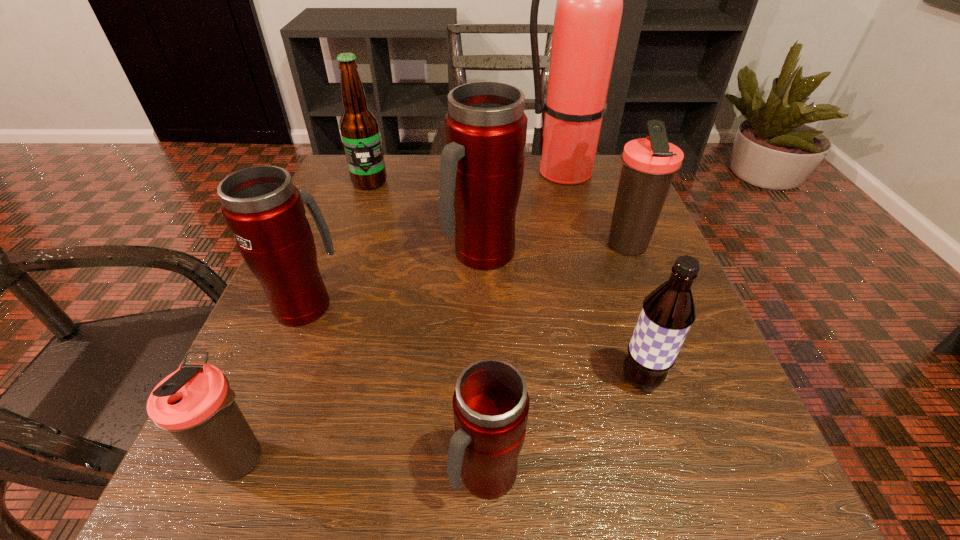
Where is `vacant space located on the side with the handle of the fifth farthest object`? This screenshot has width=960, height=540. vacant space located on the side with the handle of the fifth farthest object is located at coordinates (355, 179).

You are a GUI agent. You are given a task and a screenshot of the screen. Output one action in this format:
    pyautogui.click(x=<x>, y=<y>)
    Task: Click on the vacant position located on the side with the handle of the fifth farthest object
    This screenshot has height=540, width=960.
    Given the screenshot: What is the action you would take?
    pyautogui.click(x=357, y=174)

This screenshot has height=540, width=960. What are the coordinates of `vacant space located on the back of the root beer` in the screenshot? It's located at (624, 326).

Find the location of a particular element. The image size is (960, 540). vacant space located on the back of the nearer brown thermos bottle is located at coordinates (286, 350).

You are a GUI agent. You are given a task and a screenshot of the screen. Output one action in this format:
    pyautogui.click(x=<x>, y=<y>)
    Task: Click on the fire extinguisher located at the far edge
    This screenshot has height=540, width=960.
    Given the screenshot: What is the action you would take?
    pyautogui.click(x=588, y=13)

The width and height of the screenshot is (960, 540). I want to click on beer bottle situated at the far edge, so click(x=359, y=127).

Locate an element on the screen. beer bottle at the left edge is located at coordinates (359, 127).

Identify the location of fire extinguisher at the right edge. Image resolution: width=960 pixels, height=540 pixels. (588, 13).

Image resolution: width=960 pixels, height=540 pixels. Identify the location of thermos bottle that is at the right edge. (649, 164).

What are the coordinates of `root beer situated at the right edge` in the screenshot? It's located at (668, 312).